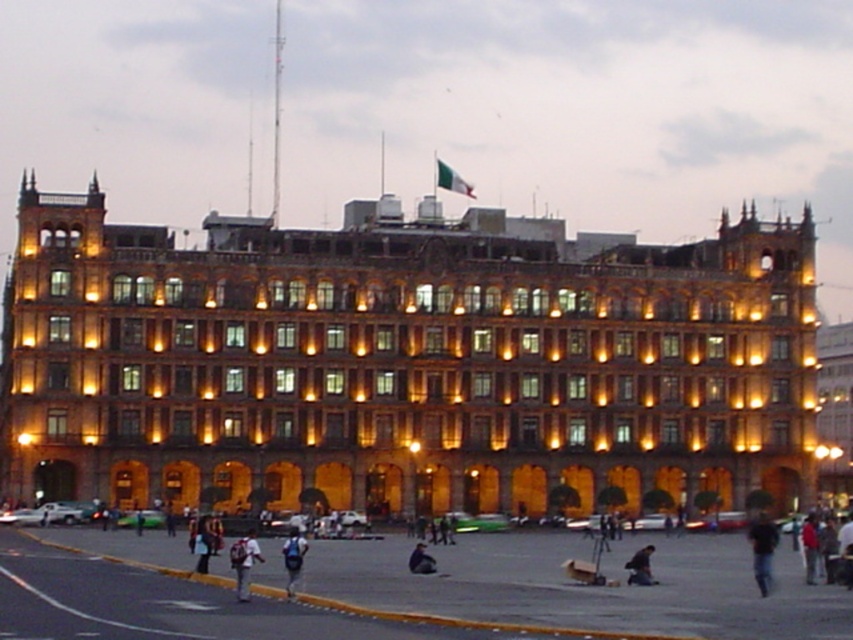
Looking at this image, who is more distant from viewer, (x=74, y=330) or (x=781, y=557)?

The point (x=781, y=557) is behind.

Does golden stone building at center appear on the left side of smooth asphalt road at lower left?

Indeed, golden stone building at center is positioned on the left side of smooth asphalt road at lower left.

Identify the location of golden stone building at center. This screenshot has height=640, width=853. (402, 362).

Who is more distant from viewer, (289, 577) or (637, 579)?

The point (637, 579) is more distant.

Does light blue backpack at center lie behind dark blue jeans at lower right?

That is False.

The height and width of the screenshot is (640, 853). What are the coordinates of `light blue backpack at center` in the screenshot? It's located at (293, 557).

Can you confirm if golden stone building at center is taller than light blue backpack at center?

Indeed, golden stone building at center has a greater height compared to light blue backpack at center.

Is the position of golden stone building at center more distant than that of light blue backpack at center?

That is True.

At what (x,y) coordinates should I click in order to perform the action: click on golden stone building at center. Please return your answer as a coordinate pair (x, y). This screenshot has width=853, height=640. Looking at the image, I should click on (402, 362).